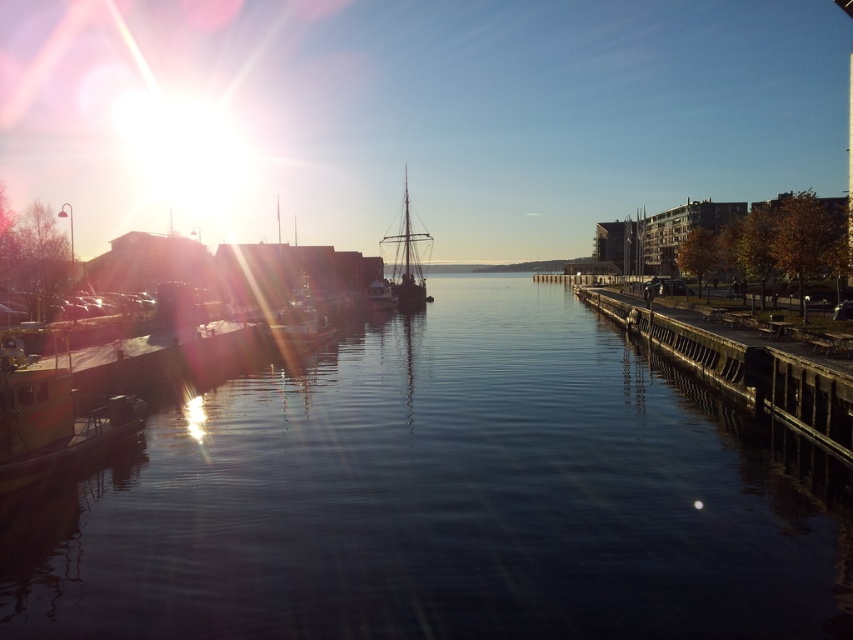
You are standing on the shore and want to board the silhouetted wooden ship at center. There is a dark gray concrete dock at center in your way. Can you walk directly to the ship without stepping on the dock?

The dark gray concrete dock at center is not as tall as the silhouetted wooden ship at center, so you can walk directly to the ship without stepping on the dock.

Looking at this image, you are a photographer planning to capture the reflection of the dark water at center and the silhouetted wooden ship at center in the image. Which object will have a smaller reflection on the water surface?

The dark water at center occupies less space than the silhouetted wooden ship at center, so its reflection will also be smaller.